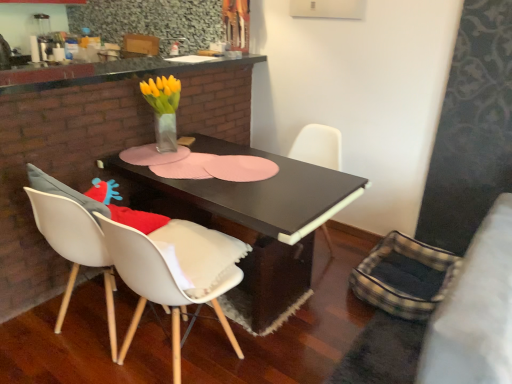
Question: Is white matte chair at lower left, the second chair viewed from the back, surrounded by black matte table at center?

Choices:
 (A) yes
 (B) no

Answer: (B)

Question: Are black matte table at center and white matte chair at lower left, which appears as the second chair when viewed from the right, located far from each other?

Choices:
 (A) no
 (B) yes

Answer: (A)

Question: Can you confirm if black matte table at center is smaller than white matte chair at lower left, the second chair viewed from the back?

Choices:
 (A) yes
 (B) no

Answer: (B)

Question: Is black matte table at center positioned with its back to white matte chair at lower left, acting as the first chair starting from the front?

Choices:
 (A) no
 (B) yes

Answer: (A)

Question: Is black matte table at center positioned in front of white matte chair at lower left, acting as the first chair starting from the front?

Choices:
 (A) no
 (B) yes

Answer: (A)

Question: From the image's perspective, is black matte table at center below white matte chair at lower left, the second chair viewed from the back?

Choices:
 (A) no
 (B) yes

Answer: (A)

Question: Are granite countertop at upper center and black matte chair at center, acting as the 2th chair starting from the left, located far from each other?

Choices:
 (A) yes
 (B) no

Answer: (A)

Question: Can you confirm if granite countertop at upper center is wider than black matte chair at center, the first chair when ordered from back to front?

Choices:
 (A) no
 (B) yes

Answer: (B)

Question: Can you confirm if granite countertop at upper center is smaller than black matte chair at center, acting as the 2th chair starting from the left?

Choices:
 (A) yes
 (B) no

Answer: (A)

Question: Is granite countertop at upper center closer to the viewer compared to black matte chair at center, acting as the 2th chair starting from the left?

Choices:
 (A) yes
 (B) no

Answer: (A)

Question: From the image's perspective, is granite countertop at upper center beneath black matte chair at center, the first chair when ordered from back to front?

Choices:
 (A) no
 (B) yes

Answer: (A)

Question: From the image's perspective, is granite countertop at upper center above black matte chair at center, the first chair when ordered from back to front?

Choices:
 (A) yes
 (B) no

Answer: (A)

Question: Would you say black matte table at center is part of black matte chair at center, the 2th chair in the front-to-back sequence,'s contents?

Choices:
 (A) yes
 (B) no

Answer: (B)